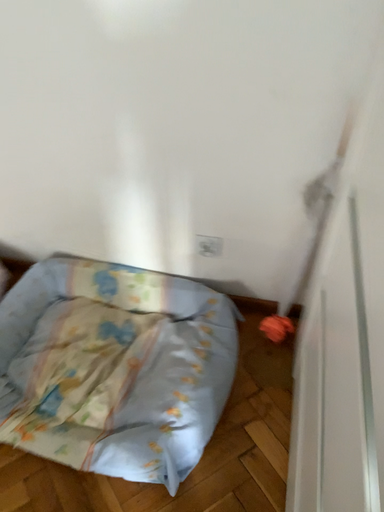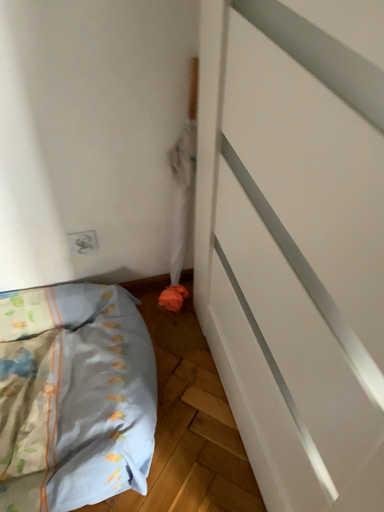
Question: How did the camera likely rotate when shooting the video?

Choices:
 (A) rotated left
 (B) rotated right

Answer: (B)